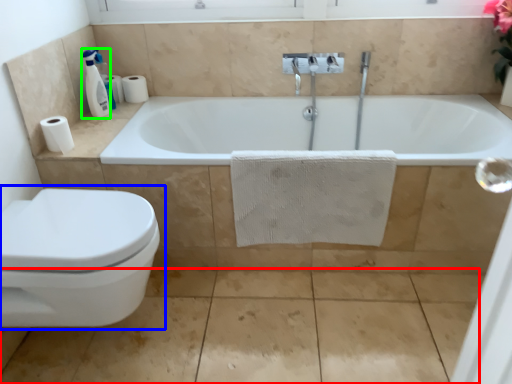
Question: Estimate the real-world distances between objects in this image. Which object is closer to concrete (highlighted by a red box), toilet (highlighted by a blue box) or soap dispenser (highlighted by a green box)?

Choices:
 (A) toilet
 (B) soap dispenser

Answer: (A)